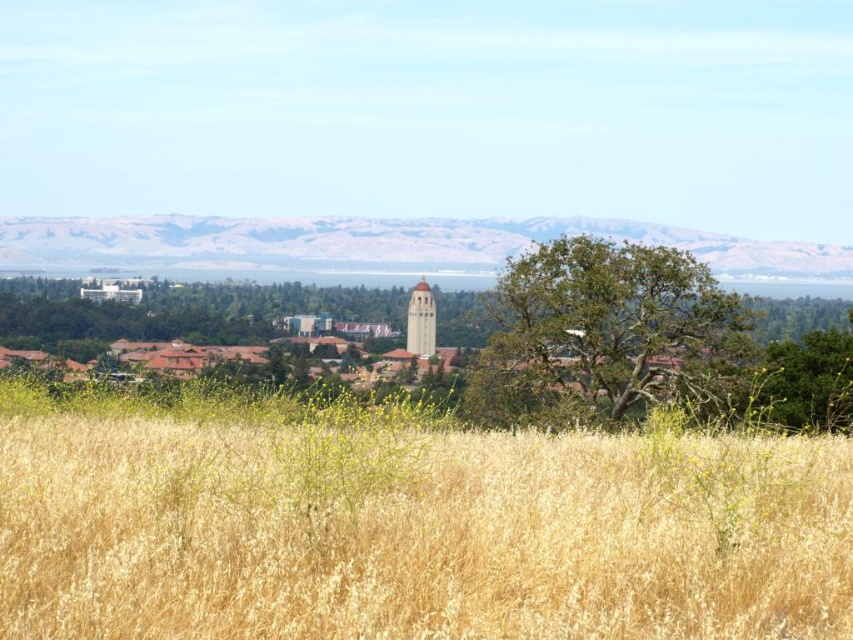
You are a landscape architect designing a new garden. You have to decide between using the dry grass at center or the green rough bark tree at center for a pathway border. Considering their thickness, which would be more suitable for a border that requires sturdier material?

The green rough bark tree at center is more suitable for a pathway border requiring sturdier material since it is thicker than the dry grass at center.

Consider the image. Based on the scene description, what is located at the coordinates point (604, 333)?

The point (604, 333) marks the location of the green rough bark tree at center.